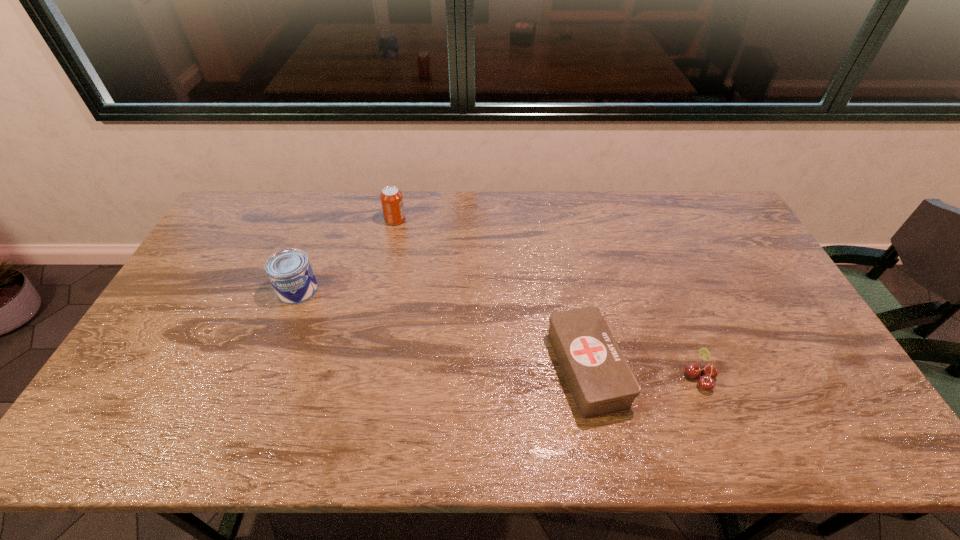
Find the location of a particular element. vacant space situated on the leaves of the rightmost object is located at coordinates (598, 377).

At what (x,y) coordinates should I click in order to perform the action: click on vacant space located 0.080m on the leaves of the rightmost object. Please return your answer as a coordinate pair (x, y). The image size is (960, 540). Looking at the image, I should click on (653, 377).

The width and height of the screenshot is (960, 540). What are the coordinates of `object positioned at the far edge` in the screenshot? It's located at (391, 197).

At what (x,y) coordinates should I click in order to perform the action: click on object that is at the near edge. Please return your answer as a coordinate pair (x, y). The image size is (960, 540). Looking at the image, I should click on (601, 382).

This screenshot has width=960, height=540. I want to click on vacant space at the far edge, so click(x=349, y=225).

Where is `vacant space at the near edge of the desktop`? This screenshot has width=960, height=540. vacant space at the near edge of the desktop is located at coordinates (732, 430).

In the image, there is a desktop. Where is `vacant space at the right edge`? The width and height of the screenshot is (960, 540). vacant space at the right edge is located at coordinates (745, 308).

Identify the location of free area in between the third nearest object and the first-aid kit. (443, 329).

Identify the location of unoccupied position between the first-aid kit and the cherry. The image size is (960, 540). pyautogui.click(x=643, y=373).

Locate an element on the screen. The width and height of the screenshot is (960, 540). blank region between the second object from right to left and the third nearest object is located at coordinates (443, 329).